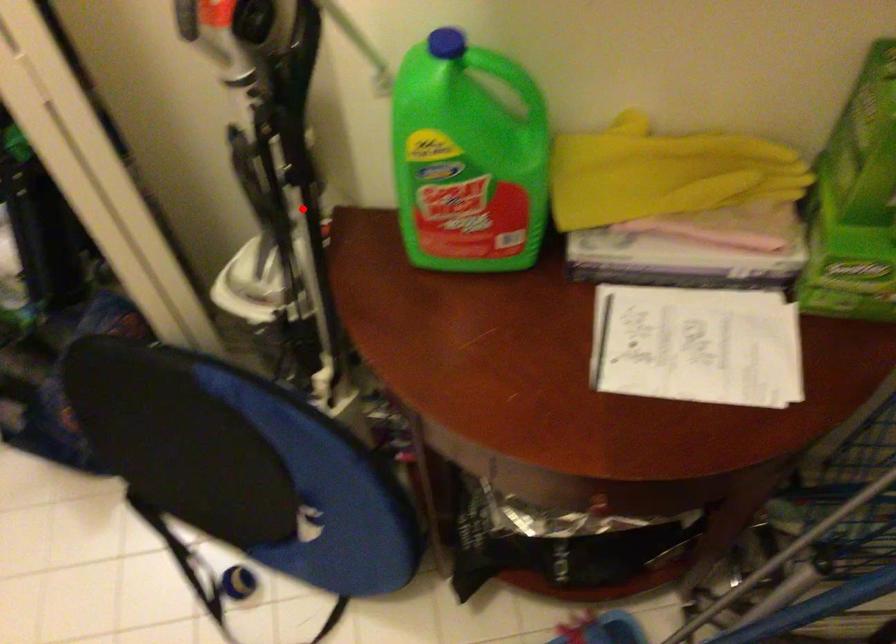
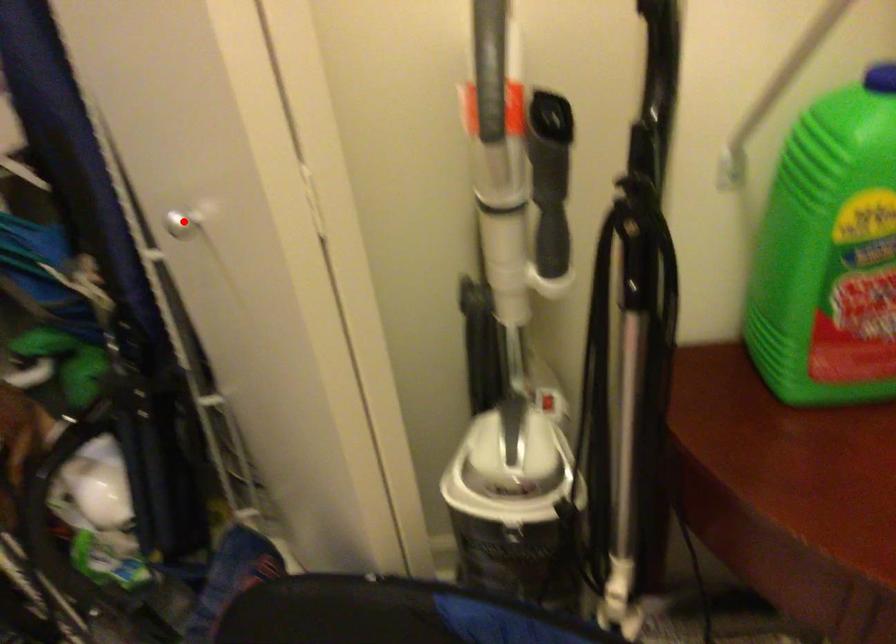
I am providing you with two images of the same scene from different viewpoints. A red point is marked on the first image and another point is marked on the second image. Is the marked point in image1 the same physical position as the marked point in image2?

No